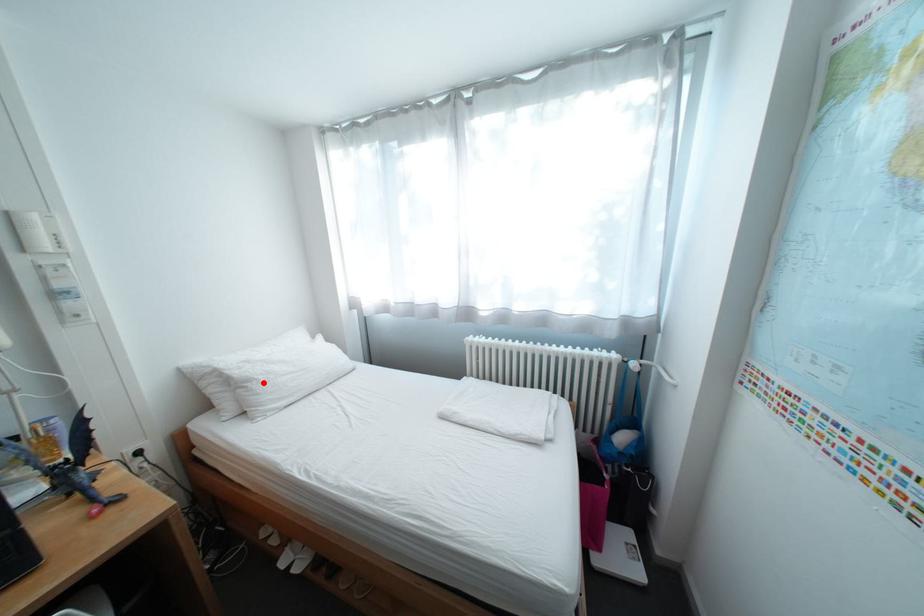
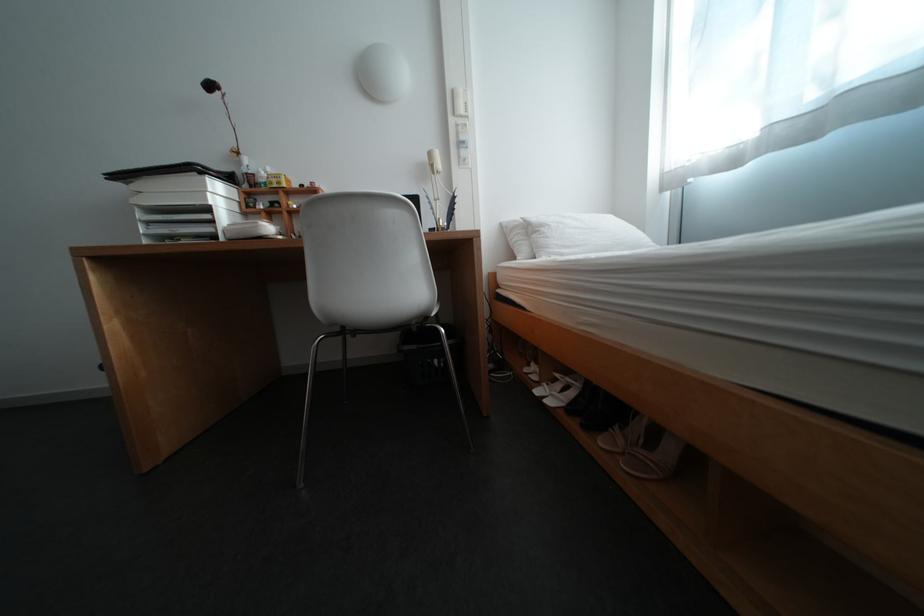
Question: I am providing you with two images of the same scene from different viewpoints. Given a red point in image1, look at the same physical point in image2. Is it:

Choices:
 (A) Closer to the viewpoint
 (B) Farther from the viewpoint

Answer: (A)